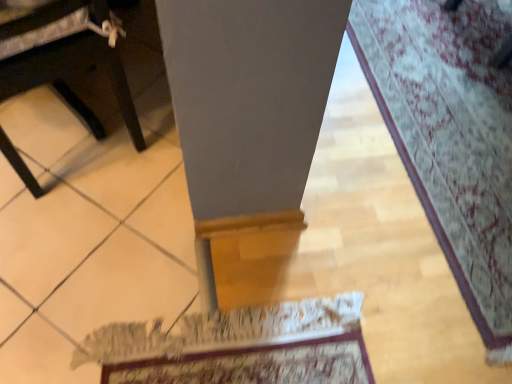
Question: Considering the relative sizes of black plastic table at lower left and patterned carpet at lower right in the image provided, is black plastic table at lower left bigger than patterned carpet at lower right?

Choices:
 (A) yes
 (B) no

Answer: (A)

Question: Is black plastic table at lower left at the left side of patterned carpet at lower right?

Choices:
 (A) yes
 (B) no

Answer: (A)

Question: From a real-world perspective, is black plastic table at lower left positioned under patterned carpet at lower right based on gravity?

Choices:
 (A) no
 (B) yes

Answer: (A)

Question: Is black plastic table at lower left smaller than patterned carpet at lower right?

Choices:
 (A) no
 (B) yes

Answer: (A)

Question: Does black plastic table at lower left have a lesser width compared to patterned carpet at lower right?

Choices:
 (A) no
 (B) yes

Answer: (B)

Question: Does black plastic table at lower left have a greater width compared to patterned carpet at lower right?

Choices:
 (A) no
 (B) yes

Answer: (A)

Question: From the image's perspective, is patterned carpet at lower right under black plastic table at lower left?

Choices:
 (A) yes
 (B) no

Answer: (A)

Question: Is patterned carpet at lower right positioned beyond the bounds of black plastic table at lower left?

Choices:
 (A) no
 (B) yes

Answer: (B)

Question: Does patterned carpet at lower right come in front of black plastic table at lower left?

Choices:
 (A) yes
 (B) no

Answer: (B)

Question: Is the depth of patterned carpet at lower right greater than that of black plastic table at lower left?

Choices:
 (A) no
 (B) yes

Answer: (B)

Question: Considering the relative sizes of patterned carpet at lower right and black plastic table at lower left in the image provided, is patterned carpet at lower right bigger than black plastic table at lower left?

Choices:
 (A) no
 (B) yes

Answer: (A)

Question: Does patterned carpet at lower right have a greater height compared to black plastic table at lower left?

Choices:
 (A) yes
 (B) no

Answer: (B)

Question: From a real-world perspective, is black plastic table at lower left physically located above or below patterned carpet at lower right?

Choices:
 (A) below
 (B) above

Answer: (B)